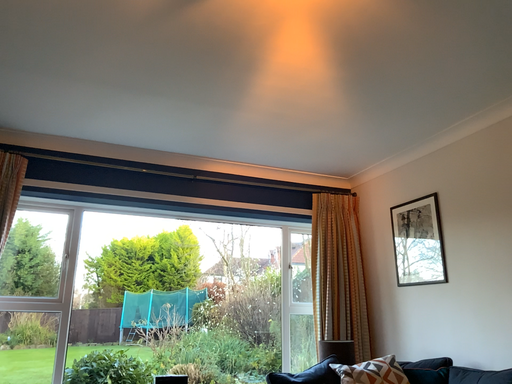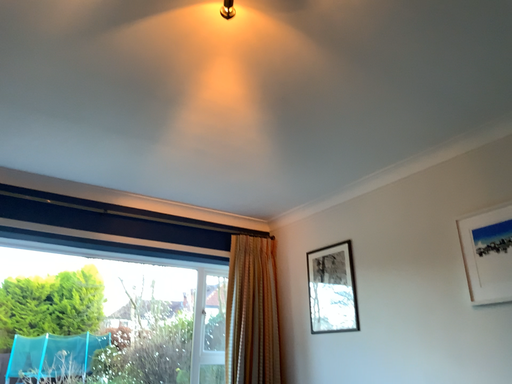
Question: How did the camera likely rotate when shooting the video?

Choices:
 (A) rotated right
 (B) rotated left

Answer: (A)